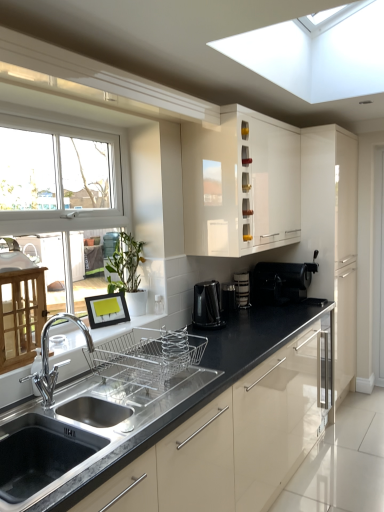
Question: Does stainless steel sink at lower left have a greater height compared to black plastic coffee maker at center, which ranks as the 2th appliance in right-to-left order?

Choices:
 (A) no
 (B) yes

Answer: (B)

Question: Considering the relative sizes of stainless steel sink at lower left and black plastic coffee maker at center, acting as the first appliance starting from the left, in the image provided, is stainless steel sink at lower left thinner than black plastic coffee maker at center, acting as the first appliance starting from the left,?

Choices:
 (A) yes
 (B) no

Answer: (B)

Question: Does stainless steel sink at lower left come behind black plastic coffee maker at center, acting as the first appliance starting from the left?

Choices:
 (A) yes
 (B) no

Answer: (B)

Question: From a real-world perspective, is stainless steel sink at lower left under black plastic coffee maker at center, which ranks as the 2th appliance in right-to-left order?

Choices:
 (A) no
 (B) yes

Answer: (B)

Question: Can you confirm if stainless steel sink at lower left is bigger than black plastic coffee maker at center, which ranks as the 2th appliance in right-to-left order?

Choices:
 (A) yes
 (B) no

Answer: (A)

Question: Is stainless steel sink at lower left not inside black plastic coffee maker at center, which ranks as the 2th appliance in right-to-left order?

Choices:
 (A) no
 (B) yes

Answer: (B)

Question: Is green matte plant at center in front of black plastic coffee machine at lower right, the 1th coffee machine when ordered from right to left?

Choices:
 (A) yes
 (B) no

Answer: (A)

Question: From a real-world perspective, does green matte plant at center sit lower than black plastic coffee machine at lower right, which ranks as the first coffee machine in back-to-front order?

Choices:
 (A) yes
 (B) no

Answer: (B)

Question: Would you say green matte plant at center is outside black plastic coffee machine at lower right, which ranks as the first coffee machine in back-to-front order?

Choices:
 (A) no
 (B) yes

Answer: (B)

Question: Can you confirm if green matte plant at center is shorter than black plastic coffee machine at lower right, which is the second coffee machine from left to right?

Choices:
 (A) yes
 (B) no

Answer: (B)

Question: Could you tell me if green matte plant at center is turned towards black plastic coffee machine at lower right, the 1th coffee machine when ordered from right to left?

Choices:
 (A) no
 (B) yes

Answer: (A)

Question: From the image's perspective, is green matte plant at center on black plastic coffee machine at lower right, which ranks as the first coffee machine in back-to-front order?

Choices:
 (A) yes
 (B) no

Answer: (A)

Question: From the image's perspective, is green matte plant at center below stainless steel sink at lower left?

Choices:
 (A) no
 (B) yes

Answer: (A)